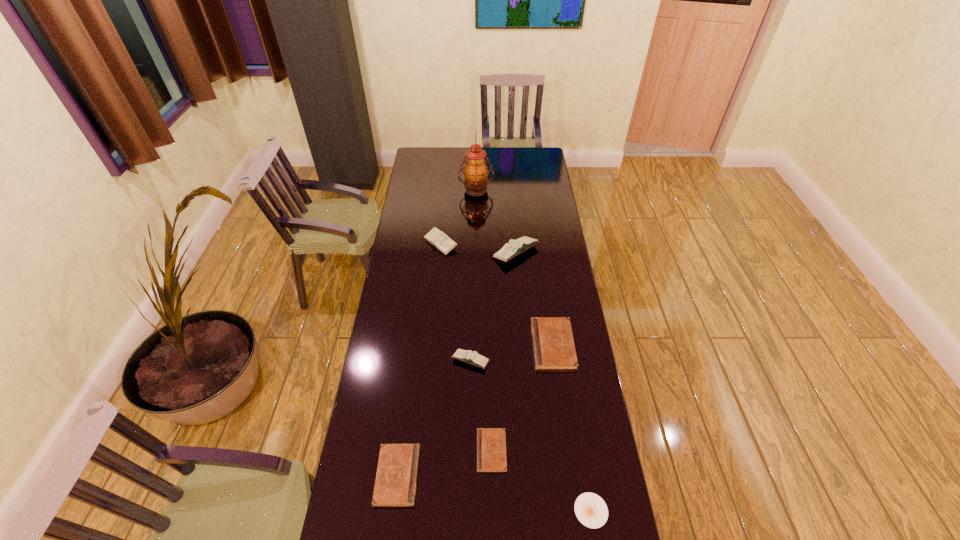
Identify the location of vacant area that lies between the shortest object and the third tallest diary. The height and width of the screenshot is (540, 960). (531, 436).

At what (x,y) coordinates should I click in order to perform the action: click on object that is the second nearest to the fourth shortest object. Please return your answer as a coordinate pair (x, y). The height and width of the screenshot is (540, 960). Looking at the image, I should click on (491, 442).

Locate which object is the third closest to the nearest pink diary. Please provide its 2D coordinates. Your answer should be formatted as a tuple, i.e. [(x, y)], where the tuple contains the x and y coordinates of a point satisfying the conditions above.

[(396, 479)]

Select which diary appears as the closest to the second shortest object. Please provide its 2D coordinates. Your answer should be formatted as a tuple, i.e. [(x, y)], where the tuple contains the x and y coordinates of a point satisfying the conditions above.

[(396, 479)]

Where is `diary that can be found as the third closest to the tallest diary`? Image resolution: width=960 pixels, height=540 pixels. diary that can be found as the third closest to the tallest diary is located at coordinates (467, 356).

What are the coordinates of `the closest pink diary relative to the smallest pink diary` in the screenshot? It's located at (515, 247).

Find the location of a particular element. The height and width of the screenshot is (540, 960). pink diary that is the closest to the seventh shortest object is located at coordinates (437, 238).

Identify which brown diary is the nearest to the sixth tallest object. Please provide its 2D coordinates. Your answer should be formatted as a tuple, i.e. [(x, y)], where the tuple contains the x and y coordinates of a point satisfying the conditions above.

[(491, 442)]

Identify which brown diary is located as the nearest to the egg yolk. Please provide its 2D coordinates. Your answer should be formatted as a tuple, i.e. [(x, y)], where the tuple contains the x and y coordinates of a point satisfying the conditions above.

[(491, 442)]

Locate an element on the screen. This screenshot has width=960, height=540. free point that satisfies the following two spatial constraints: 1. on the spine side of the smallest brown diary; 2. on the right side of the white egg yolk is located at coordinates (492, 511).